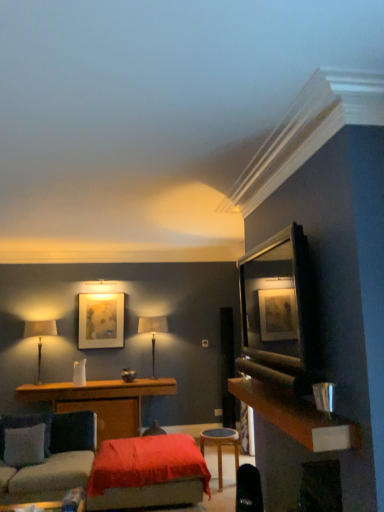
Question: Is matte beige table lamp at left, which is counted as the second table lamp, starting from the right, to the left of velvet red ottoman at center from the viewer's perspective?

Choices:
 (A) yes
 (B) no

Answer: (A)

Question: Is matte beige table lamp at left, which is counted as the second table lamp, starting from the right, facing away from velvet red ottoman at center?

Choices:
 (A) no
 (B) yes

Answer: (A)

Question: Is matte beige table lamp at left, positioned as the 1th table lamp in left-to-right order, closer to camera compared to velvet red ottoman at center?

Choices:
 (A) yes
 (B) no

Answer: (B)

Question: Does matte beige table lamp at left, which is counted as the second table lamp, starting from the right, have a smaller size compared to velvet red ottoman at center?

Choices:
 (A) yes
 (B) no

Answer: (A)

Question: Is velvet red ottoman at center inside matte beige table lamp at left, which is counted as the second table lamp, starting from the right?

Choices:
 (A) no
 (B) yes

Answer: (A)

Question: Is wooden table at center, which appears as the first table when viewed from the back, taller or shorter than matte black table lamp at center, the 1th table lamp viewed from the right?

Choices:
 (A) short
 (B) tall

Answer: (A)

Question: Is wooden table at center, which appears as the first table when viewed from the back, bigger or smaller than matte black table lamp at center, positioned as the second table lamp in left-to-right order?

Choices:
 (A) big
 (B) small

Answer: (A)

Question: In terms of width, does wooden table at center, which is the 2th table in right-to-left order, look wider or thinner when compared to matte black table lamp at center, the 1th table lamp viewed from the right?

Choices:
 (A) thin
 (B) wide

Answer: (B)

Question: From a real-world perspective, is wooden table at center, which is the 2th table in right-to-left order, physically located above or below matte black table lamp at center, the 1th table lamp viewed from the right?

Choices:
 (A) above
 (B) below

Answer: (B)

Question: In terms of width, does velvet red ottoman at center look wider or thinner when compared to wooden framed mirror at upper right?

Choices:
 (A) wide
 (B) thin

Answer: (A)

Question: From the image's perspective, is velvet red ottoman at center located above or below wooden framed mirror at upper right?

Choices:
 (A) above
 (B) below

Answer: (B)

Question: Visually, is velvet red ottoman at center positioned to the left or to the right of wooden framed mirror at upper right?

Choices:
 (A) right
 (B) left

Answer: (B)

Question: Considering their positions, is velvet red ottoman at center located in front of or behind wooden framed mirror at upper right?

Choices:
 (A) behind
 (B) front

Answer: (A)

Question: Is wooden table at center, which appears as the first table when viewed from the back, inside the boundaries of velvet red ottoman at center, or outside?

Choices:
 (A) outside
 (B) inside

Answer: (A)

Question: From the image's perspective, is wooden table at center, which appears as the first table when viewed from the back, located above or below velvet red ottoman at center?

Choices:
 (A) above
 (B) below

Answer: (B)